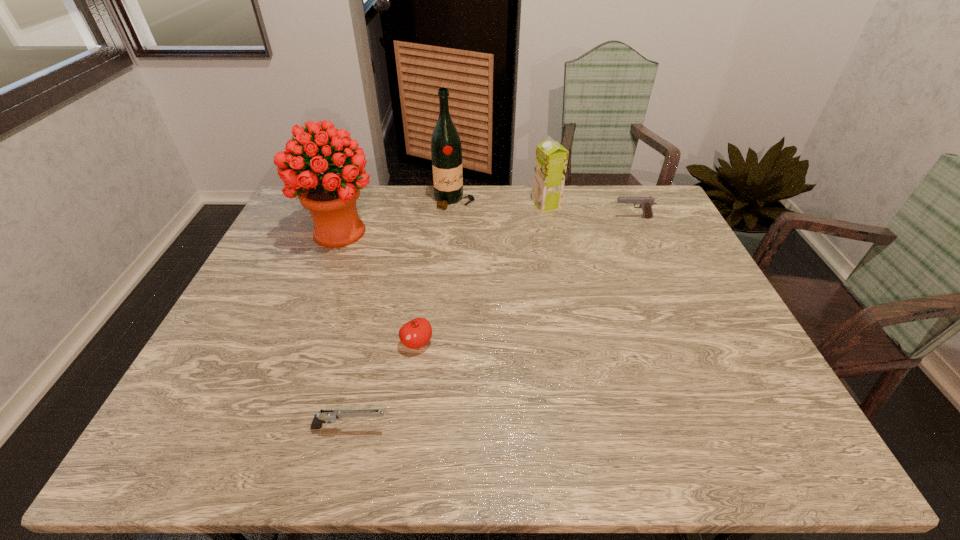
Locate an element on the screen. This screenshot has width=960, height=540. wine bottle is located at coordinates (446, 150).

The image size is (960, 540). Identify the location of bouquet. [x=331, y=197].

The width and height of the screenshot is (960, 540). In order to click on the fifth object from left to right in this screenshot , I will do `click(551, 159)`.

Identify the location of soya milk. This screenshot has height=540, width=960. (551, 159).

What are the coordinates of `the farther pistol` in the screenshot? It's located at (646, 203).

Identify the location of the taller pistol. This screenshot has height=540, width=960. (646, 203).

I want to click on apple, so click(x=416, y=333).

This screenshot has height=540, width=960. I want to click on the nearer pistol, so click(324, 415).

At what (x,y) coordinates should I click in order to perform the action: click on the shorter pistol. Please return your answer as a coordinate pair (x, y). Looking at the image, I should click on (324, 415).

Identify the location of vacant space situated 0.190m on the right of the wine bottle. Image resolution: width=960 pixels, height=540 pixels. (529, 200).